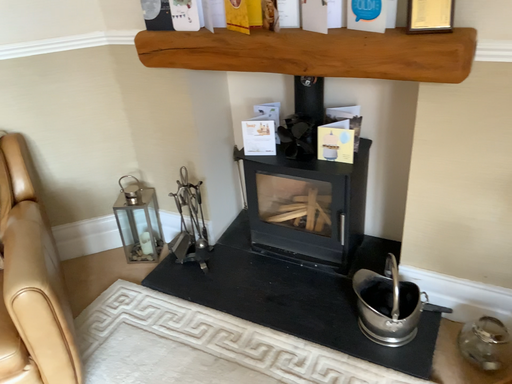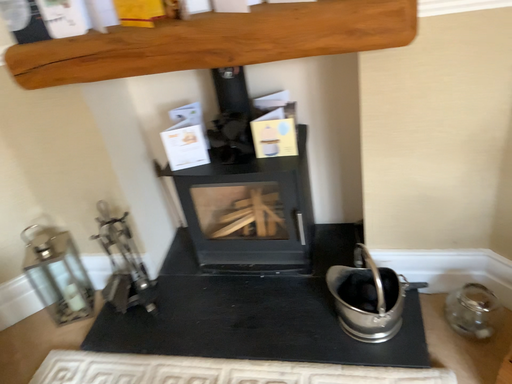
Question: How did the camera likely rotate when shooting the video?

Choices:
 (A) rotated right
 (B) rotated left

Answer: (A)